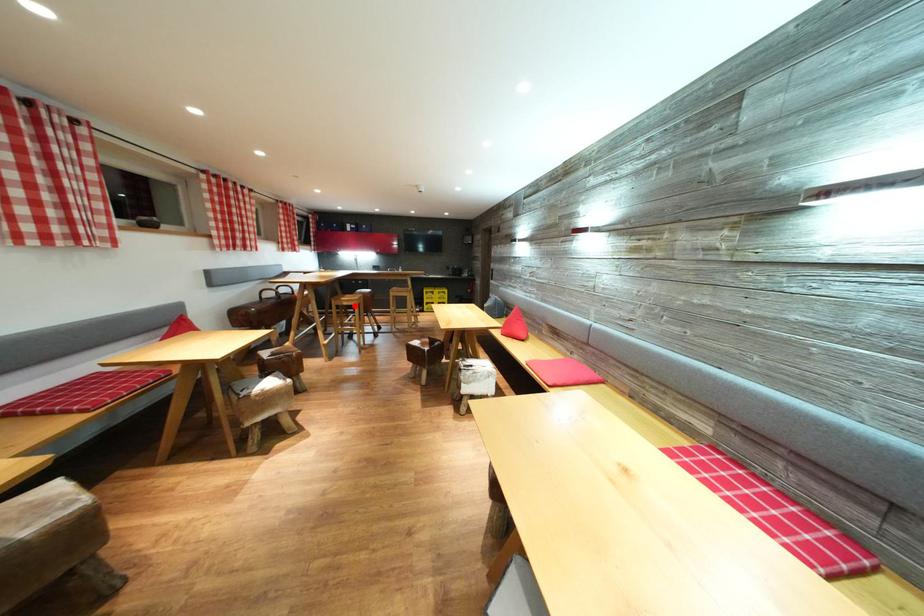
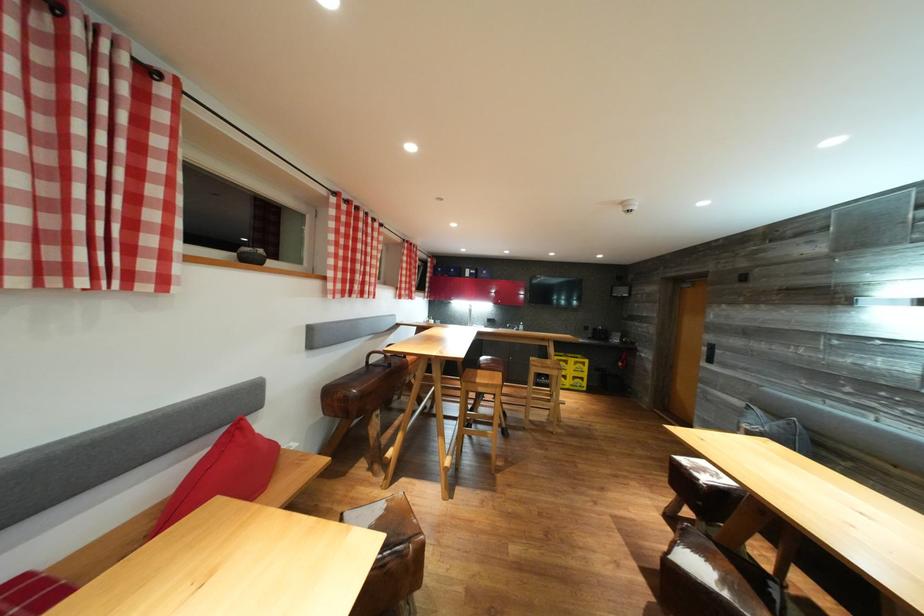
In the second image, find the point that corresponds to the highlighted location in the first image.

(492, 391)